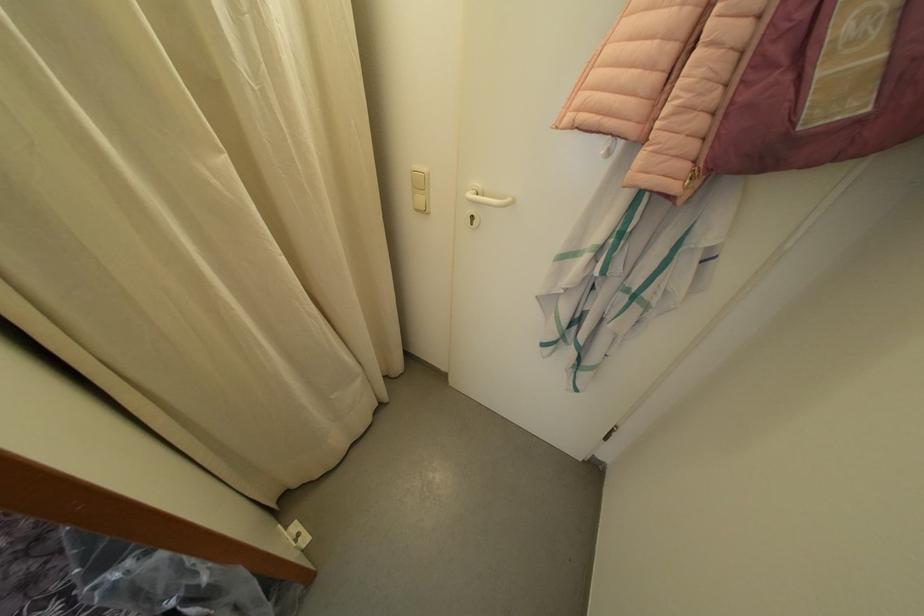
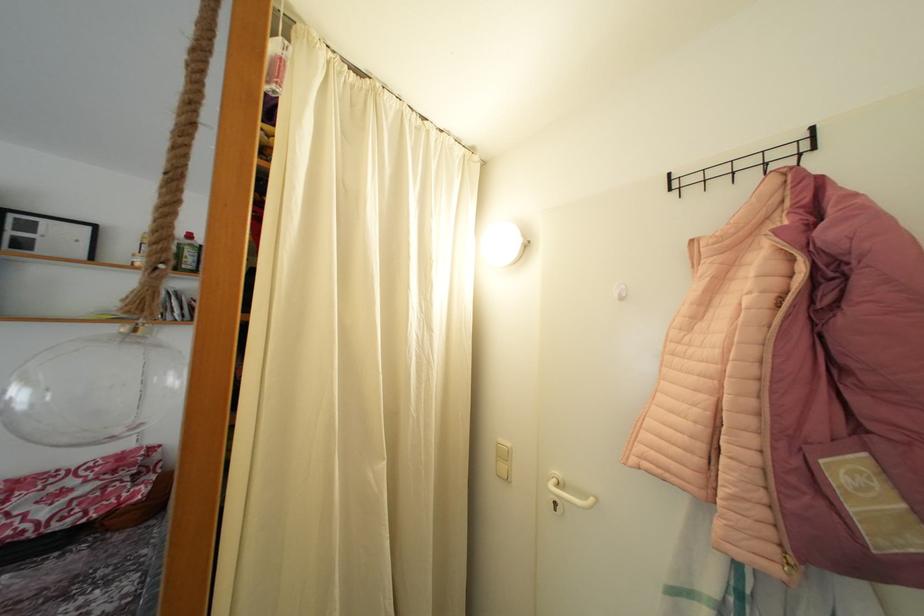
The images are taken continuously from a first-person perspective. In which direction is your viewpoint rotating?

The camera's rotation is toward left-up.